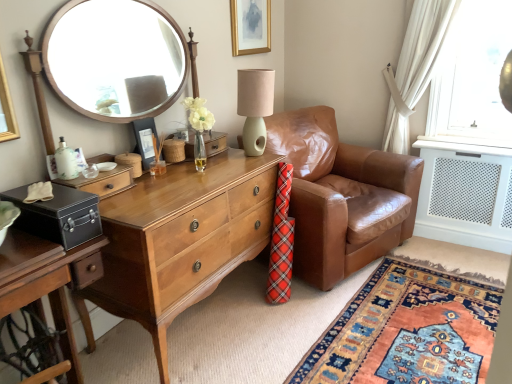
Question: Considering the relative sizes of carpet with intricate patterns at lower right and mint green ceramic table lamp at center in the image provided, is carpet with intricate patterns at lower right bigger than mint green ceramic table lamp at center?

Choices:
 (A) no
 (B) yes

Answer: (B)

Question: Considering the relative sizes of carpet with intricate patterns at lower right and mint green ceramic table lamp at center in the image provided, is carpet with intricate patterns at lower right taller than mint green ceramic table lamp at center?

Choices:
 (A) no
 (B) yes

Answer: (A)

Question: Is carpet with intricate patterns at lower right not close to mint green ceramic table lamp at center?

Choices:
 (A) yes
 (B) no

Answer: (A)

Question: Can you confirm if carpet with intricate patterns at lower right is shorter than mint green ceramic table lamp at center?

Choices:
 (A) yes
 (B) no

Answer: (A)

Question: Is mint green ceramic table lamp at center a part of carpet with intricate patterns at lower right?

Choices:
 (A) yes
 (B) no

Answer: (B)

Question: Can you confirm if carpet with intricate patterns at lower right is wider than mint green ceramic table lamp at center?

Choices:
 (A) yes
 (B) no

Answer: (A)

Question: Is light brown wood desk at center smaller than matte black safe at left?

Choices:
 (A) yes
 (B) no

Answer: (B)

Question: Is light brown wood desk at center facing away from matte black safe at left?

Choices:
 (A) no
 (B) yes

Answer: (A)

Question: Is light brown wood desk at center at the left side of matte black safe at left?

Choices:
 (A) no
 (B) yes

Answer: (A)

Question: Considering the relative sizes of light brown wood desk at center and matte black safe at left in the image provided, is light brown wood desk at center shorter than matte black safe at left?

Choices:
 (A) no
 (B) yes

Answer: (A)

Question: Can we say light brown wood desk at center lies outside matte black safe at left?

Choices:
 (A) no
 (B) yes

Answer: (B)

Question: Is the position of light brown wood desk at center more distant than that of matte black safe at left?

Choices:
 (A) yes
 (B) no

Answer: (A)

Question: From the image's perspective, is black matte picture frame at center, positioned as the first picture frame in left-to-right order, above brown leather armchair at center?

Choices:
 (A) yes
 (B) no

Answer: (A)